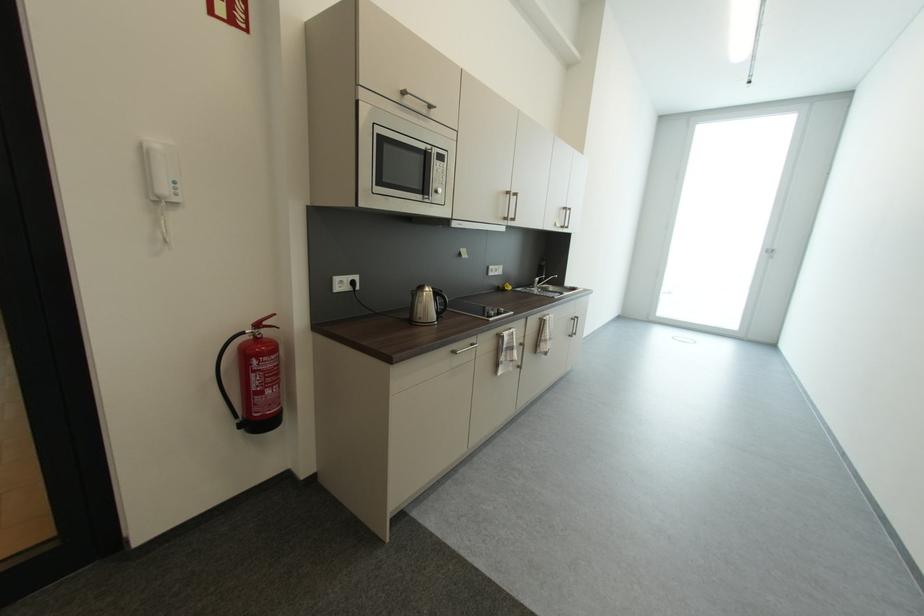
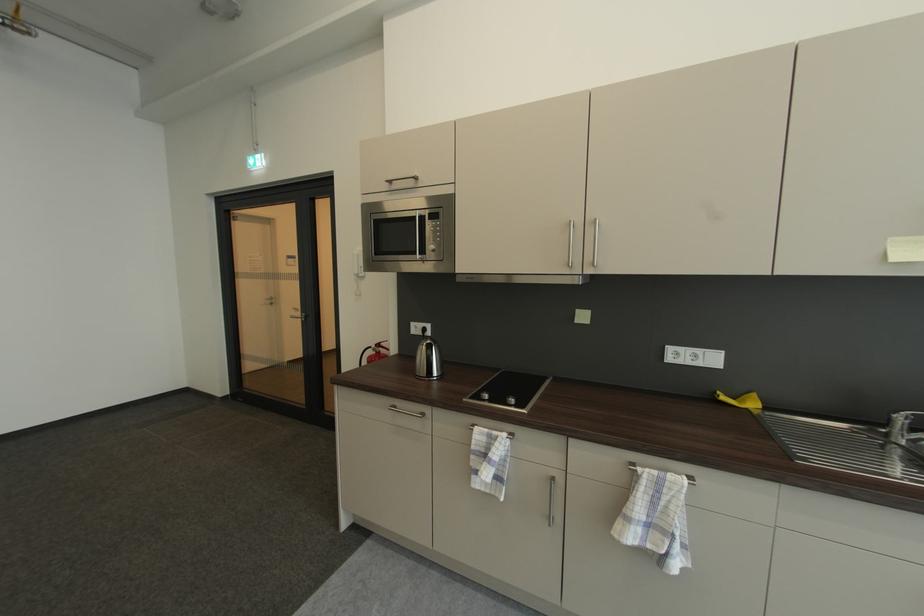
Locate, in the second image, the point that corresponds to point (443, 322) in the first image.

(432, 378)